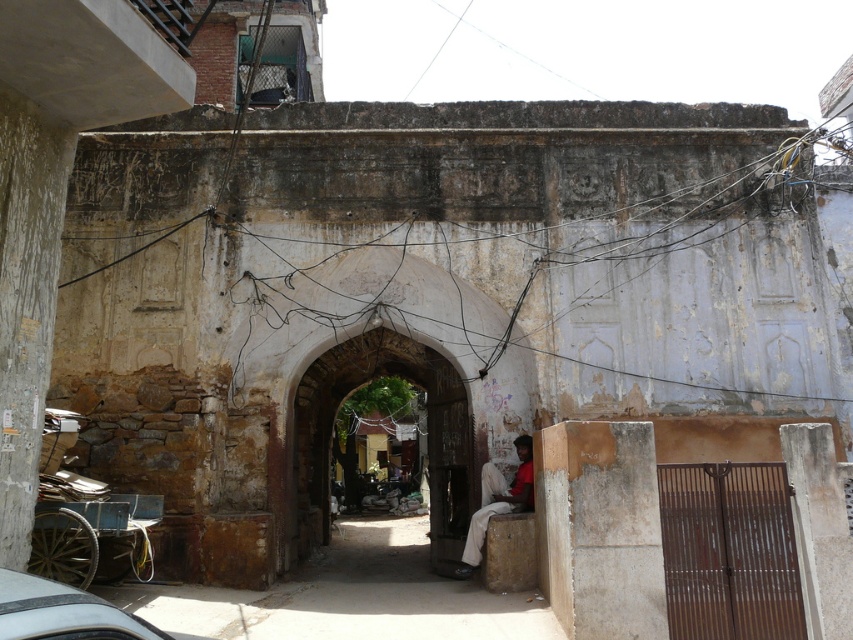
You are standing in front of the old stone archway and notice two points marked on the archway. The first point is at coordinate point (32, 552), and the second is at coordinate point (4, 573). Which of these two points is closer to you as you stand in front of the archway?

Point (32, 552) is closer to you because it is further to the viewer than point (4, 573).

You are standing in the old stone archway and want to exit to the rustic concrete alley at center. Which direction should you walk relative to the wooden cart at lower left?

The rustic concrete alley at center is to the right of the wooden cart at lower left, so you should walk to the right of the wooden cart at lower left to reach the rustic concrete alley at center.